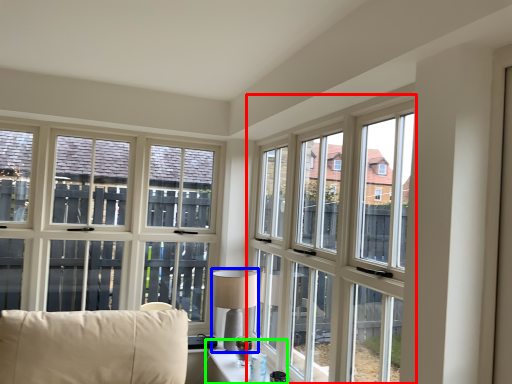
Question: Which object is the closest to the window (highlighted by a red box)? Choose among these: table lamp (highlighted by a blue box) or table (highlighted by a green box).

Choices:
 (A) table lamp
 (B) table

Answer: (A)